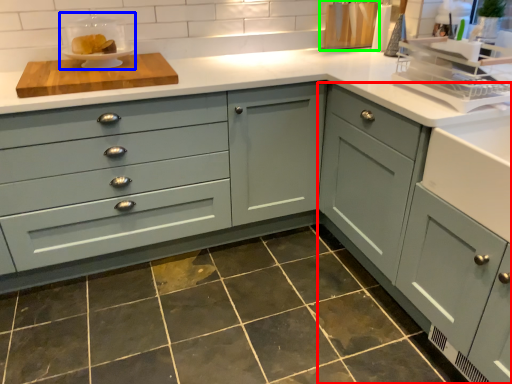
Question: Based on their relative distances, which object is nearer to cabinetry (highlighted by a red box)? Choose from appliance (highlighted by a blue box) and appliance (highlighted by a green box).

Choices:
 (A) appliance
 (B) appliance

Answer: (B)